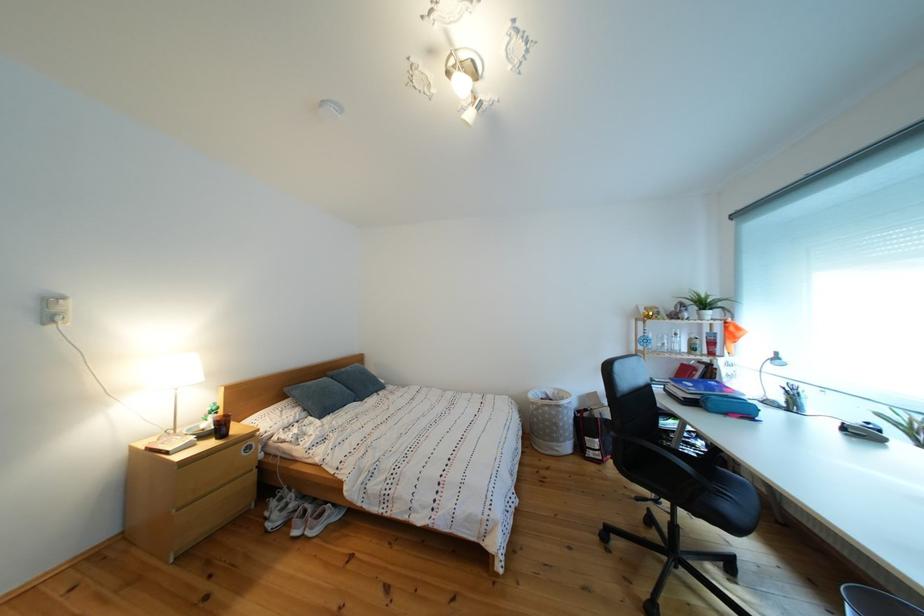
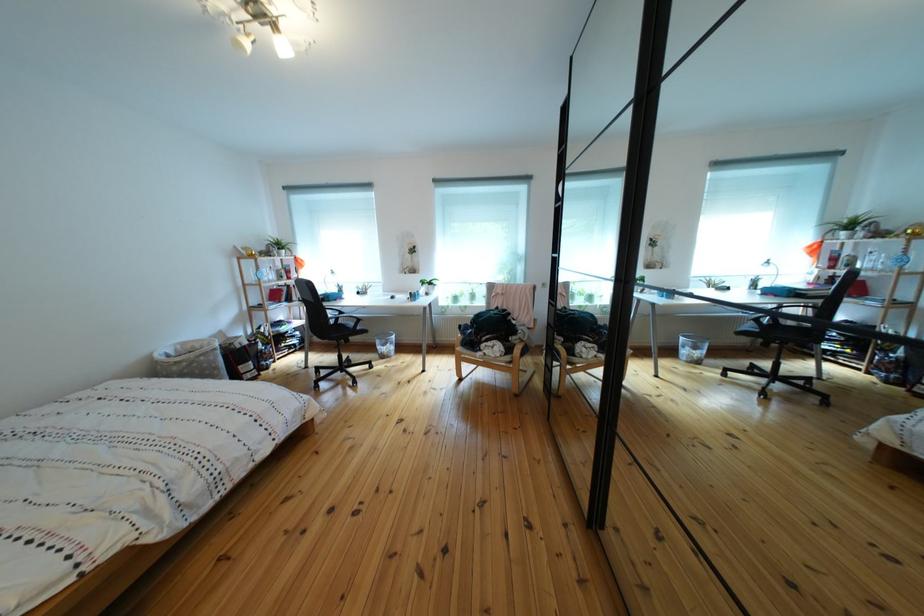
Find the pixel in the second image that matches the point at 565,400 in the first image.

(187, 355)